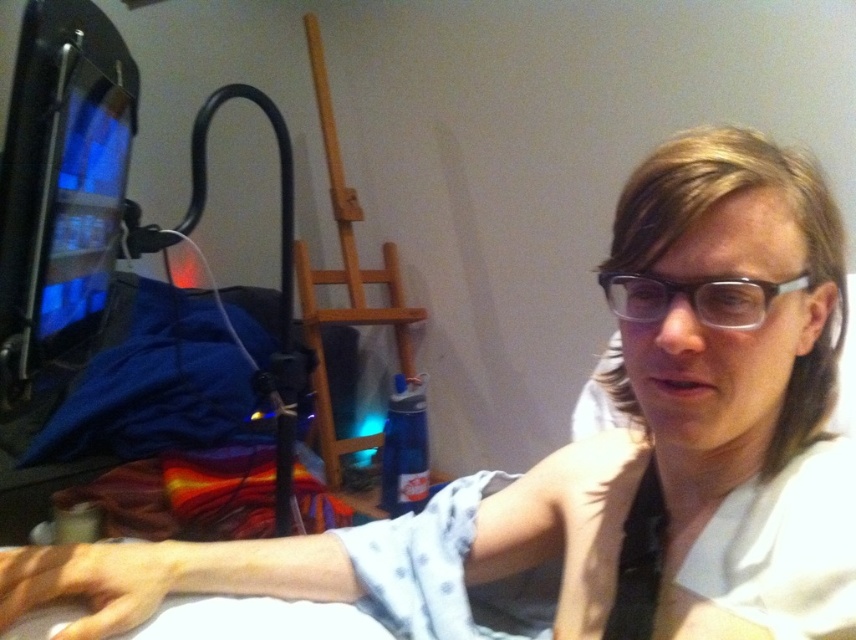
Question: Is matte black monitor at left positioned before clear plastic glasses at center?

Choices:
 (A) no
 (B) yes

Answer: (A)

Question: Which object is farther from the camera taking this photo?

Choices:
 (A) matte black monitor at left
 (B) clear plastic glasses at center

Answer: (A)

Question: Which object is closer to the camera taking this photo?

Choices:
 (A) clear plastic glasses at center
 (B) matte black monitor at left

Answer: (A)

Question: Considering the relative positions of matte black monitor at left and clear plastic glasses at center in the image provided, where is matte black monitor at left located with respect to clear plastic glasses at center?

Choices:
 (A) above
 (B) below

Answer: (A)

Question: Can you confirm if matte black monitor at left is positioned above clear plastic glasses at center?

Choices:
 (A) no
 (B) yes

Answer: (B)

Question: Which of the following is the farthest from the observer?

Choices:
 (A) [79, 216]
 (B) [726, 328]

Answer: (A)